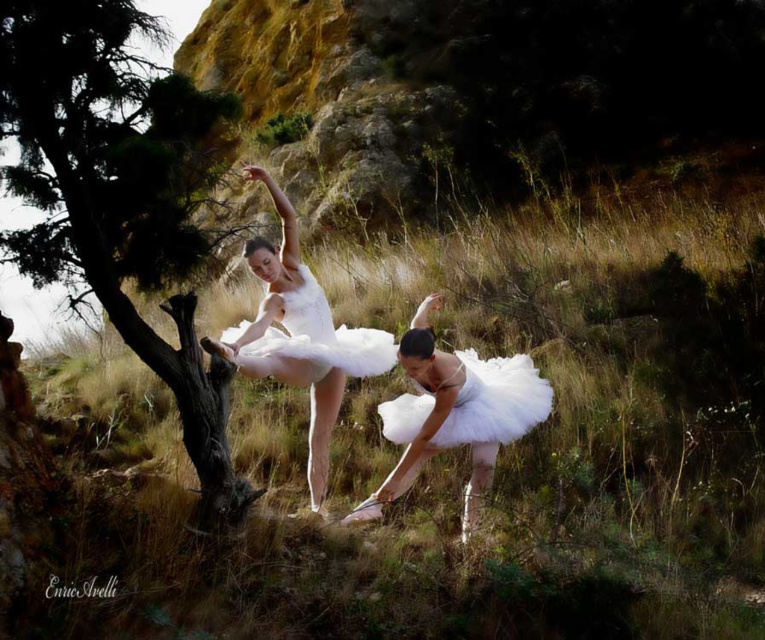
Does green textured tree at left have a lesser height compared to white satin tutu at center?

No.

Does point (86, 225) come behind point (360, 339)?

No, (86, 225) is in front of (360, 339).

Which is behind, point (103, 301) or point (275, 195)?

Positioned behind is point (275, 195).

Locate an element on the screen. The image size is (765, 640). green textured tree at left is located at coordinates (119, 195).

Does point (386, 369) come closer to viewer compared to point (295, 353)?

No, (386, 369) is further to viewer.

Does white satin tutu at center appear on the left side of white tulle dress at center?

Yes, white satin tutu at center is to the left of white tulle dress at center.

Who is more distant from viewer, (x=246, y=172) or (x=300, y=346)?

Positioned behind is point (x=300, y=346).

Identify the location of white satin tutu at center. (301, 337).

What do you see at coordinates (119, 195) in the screenshot? I see `green textured tree at left` at bounding box center [119, 195].

Which of these two, green textured tree at left or white tulle tutu at center, stands taller?

Standing taller between the two is green textured tree at left.

Which is behind, point (2, 77) or point (467, 529)?

Point (467, 529)

Find the location of a particular element. green textured tree at left is located at coordinates (119, 195).